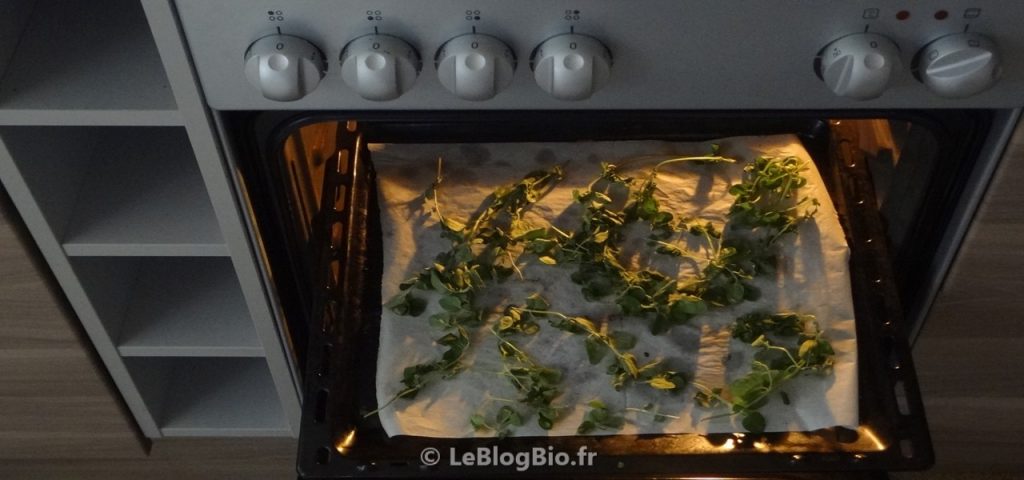
You are a GUI agent. You are given a task and a screenshot of the screen. Output one action in this format:
    pyautogui.click(x=<x>, y=<y>)
    Task: Click on the knob on left
    The height and width of the screenshot is (480, 1024).
    Given the screenshot: What is the action you would take?
    pyautogui.click(x=281, y=69)